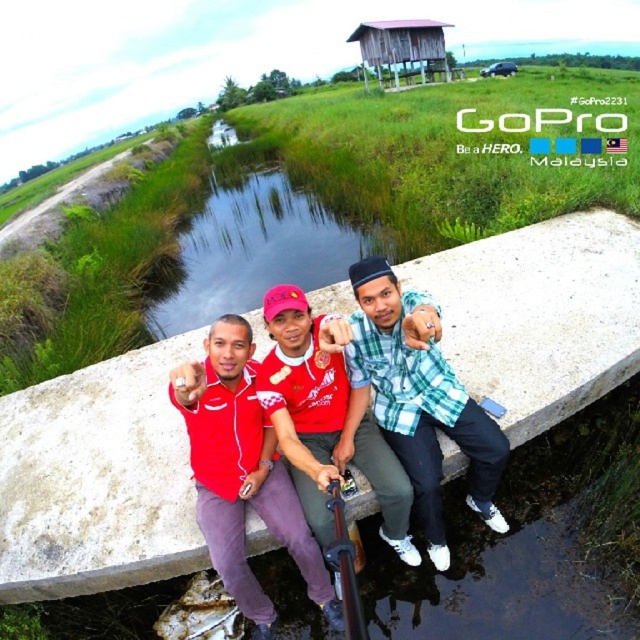
Question: Which point appears farthest from the camera in this image?

Choices:
 (A) (387, 58)
 (B) (417, 560)

Answer: (A)

Question: Which of the following is the closest to the observer?

Choices:
 (A) white concrete ledge at center
 (B) matte red shirt at center
 (C) checkered fabric shirt at center

Answer: (C)

Question: Does checkered fabric shirt at center have a larger size compared to wooden stilt house at upper center?

Choices:
 (A) no
 (B) yes

Answer: (A)

Question: Considering the real-world distances, which object is farthest from the wooden stilt house at upper center?

Choices:
 (A) white concrete ledge at center
 (B) red fabric shirt at center
 (C) matte red shirt at center

Answer: (B)

Question: Can you confirm if white concrete ledge at center is bigger than red fabric shirt at center?

Choices:
 (A) no
 (B) yes

Answer: (B)

Question: Can you confirm if matte red shirt at center is positioned above red fabric shirt at center?

Choices:
 (A) yes
 (B) no

Answer: (B)